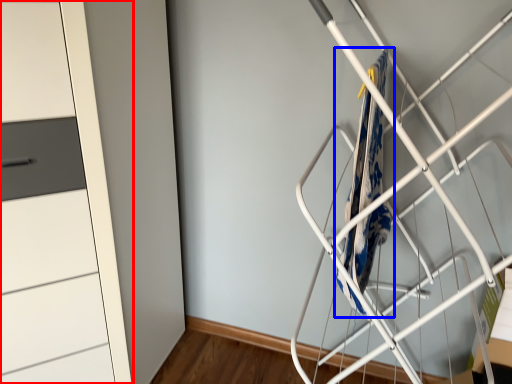
Question: Among these objects, which one is nearest to the camera, cupboard (highlighted by a red box) or blanket (highlighted by a blue box)?

Choices:
 (A) cupboard
 (B) blanket

Answer: (A)